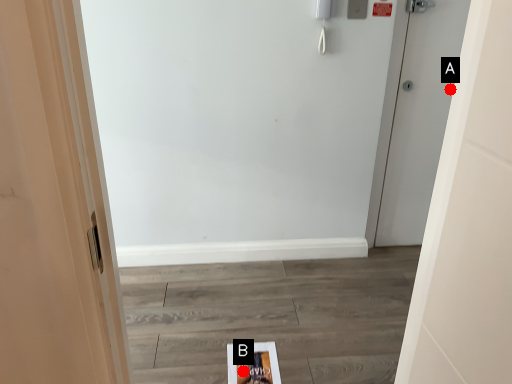
Question: Two points are circled on the image, labeled by A and B beside each circle. Which point appears farthest from the camera in this image?

Choices:
 (A) A is further
 (B) B is further

Answer: (A)